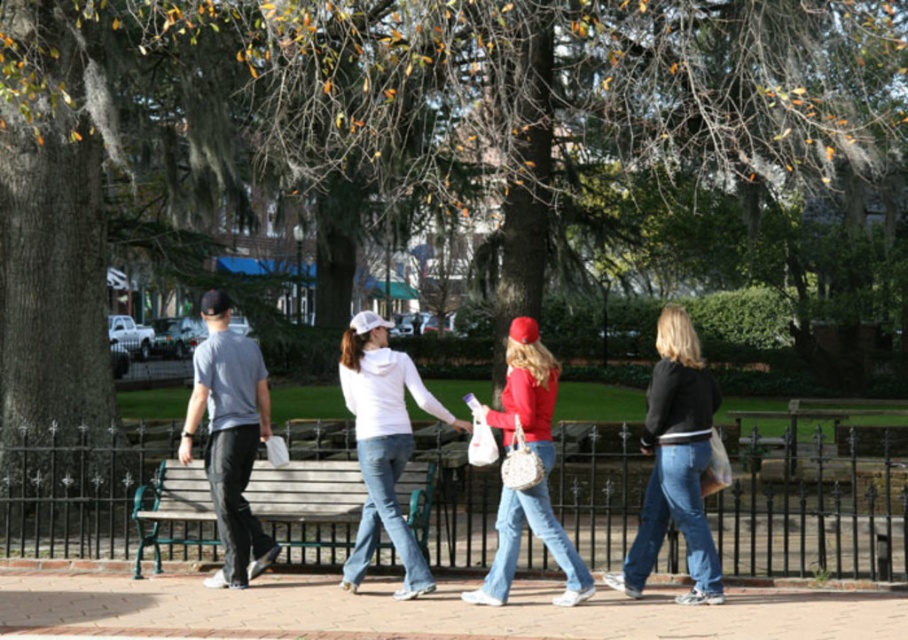
Question: Estimate the real-world distances between objects in this image. Which object is closer to the matte red jacket at center?

Choices:
 (A) white matte hoodie at center
 (B) gray cotton t-shirt at left

Answer: (A)

Question: Is the position of denim jeans at center less distant than that of matte red jacket at center?

Choices:
 (A) no
 (B) yes

Answer: (A)

Question: Which object appears farthest from the camera in this image?

Choices:
 (A) denim jeans at center
 (B) matte red jacket at center
 (C) gray cotton t-shirt at left
 (D) white matte hoodie at center

Answer: (C)

Question: Is wooden bench at center closer to the viewer compared to white matte hoodie at center?

Choices:
 (A) yes
 (B) no

Answer: (B)

Question: Does gray cotton t-shirt at left appear under matte red jacket at center?

Choices:
 (A) no
 (B) yes

Answer: (A)

Question: Estimate the real-world distances between objects in this image. Which object is farther from the denim jeans at center?

Choices:
 (A) white matte hoodie at center
 (B) gray cotton t-shirt at left
 (C) matte red jacket at center

Answer: (B)